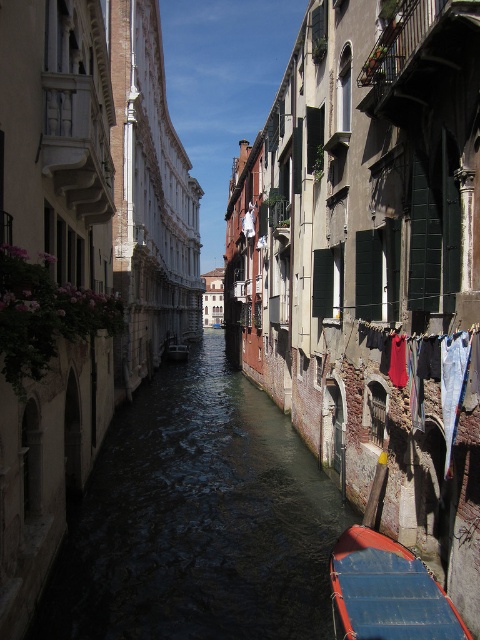
You are standing on the canal bridge and see the point marked at coordinates (x=387, y=592). What object is this point located on?

The point marked at coordinates (x=387, y=592) is located on the orange fabric boat at lower center.

You are a tourist standing at the edge of the canal. You want to take a photo of the dark water at center and the red fabric clothesline at right. Which object appears taller in the photo?

The dark water at center appears taller than the red fabric clothesline at right in the photo because the dark water at center has a greater height compared to the red fabric clothesline at right.